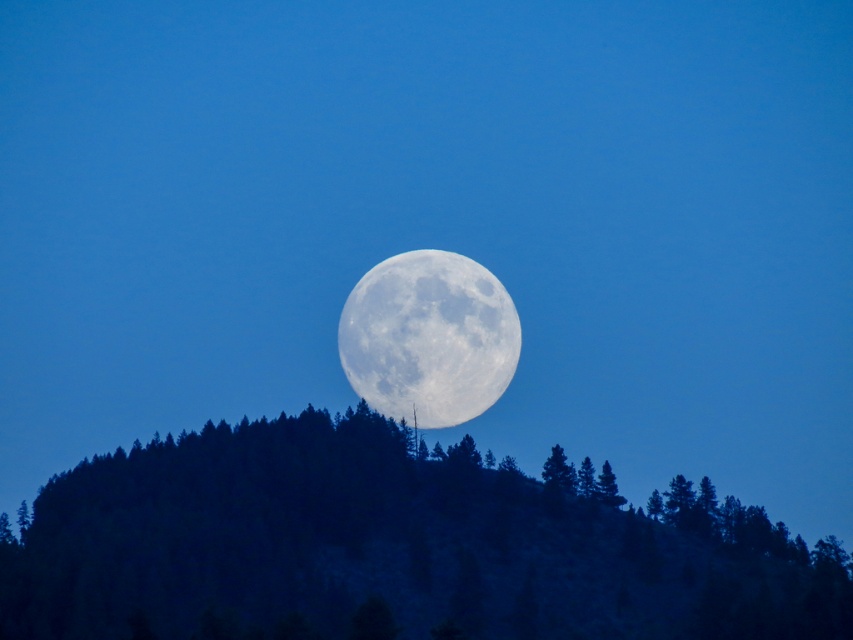
You are an astronomer observing the night sky and see the green textured tree at upper center and the white textured moon at center. Which object appears closer to you in the image?

The green textured tree at upper center appears closer to you than the white textured moon at center in the image.

You are an astronomer observing the night sky. You notice the green textured tree at upper center and the white textured moon at center. How far apart are these two celestial objects in feet?

The distance between the green textured tree at upper center and the white textured moon at center is 206.72 feet.

You are an astronomer observing the night sky from a location where the full moon is centered in your view. You notice a point marked at coordinates (389, 548) relative to the moon. What object is located at that point?

The point at coordinates (389, 548) is where the green textured tree at upper center is located.